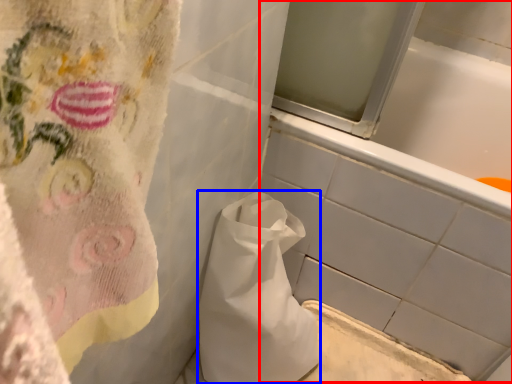
Question: Which object appears farthest to the camera in this image, bath (highlighted by a red box) or paper bag (highlighted by a blue box)?

Choices:
 (A) bath
 (B) paper bag

Answer: (A)